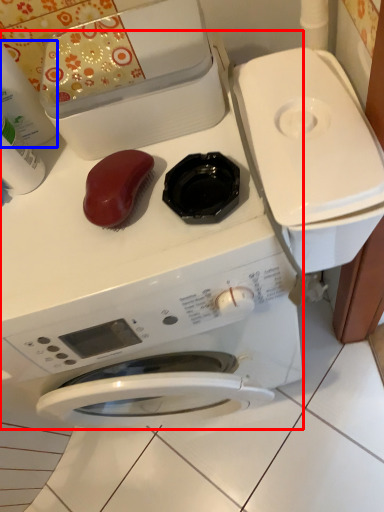
Question: Which of the following is the farthest to the observer, washing machine (highlighted by a red box) or cleaning product (highlighted by a blue box)?

Choices:
 (A) washing machine
 (B) cleaning product

Answer: (B)